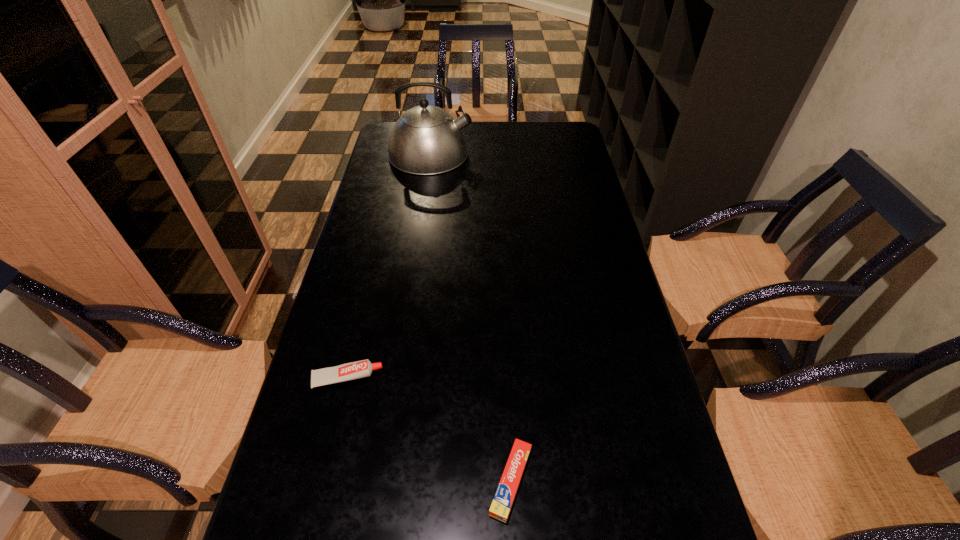
What are the coordinates of `kettle that is at the left edge` in the screenshot? It's located at (426, 140).

The height and width of the screenshot is (540, 960). Identify the location of toothpaste that is at the left edge. (359, 369).

The image size is (960, 540). What are the coordinates of `object that is at the far left corner` in the screenshot? It's located at (426, 140).

The width and height of the screenshot is (960, 540). I want to click on vacant space at the far edge, so click(498, 126).

This screenshot has width=960, height=540. Identify the location of vacant space at the left edge. (309, 387).

Locate an element on the screen. The image size is (960, 540). vacant space at the right edge is located at coordinates point(569,230).

Where is `vacant space at the far right corner`? The width and height of the screenshot is (960, 540). vacant space at the far right corner is located at coordinates (552, 133).

Where is `free space between the rightmost object and the farthest object`? free space between the rightmost object and the farthest object is located at coordinates (470, 317).

Locate an element on the screen. free space that is in between the second shortest object and the tallest object is located at coordinates (389, 266).

What are the coordinates of `unoccupied area between the nearest object and the second farthest object` in the screenshot? It's located at (429, 429).